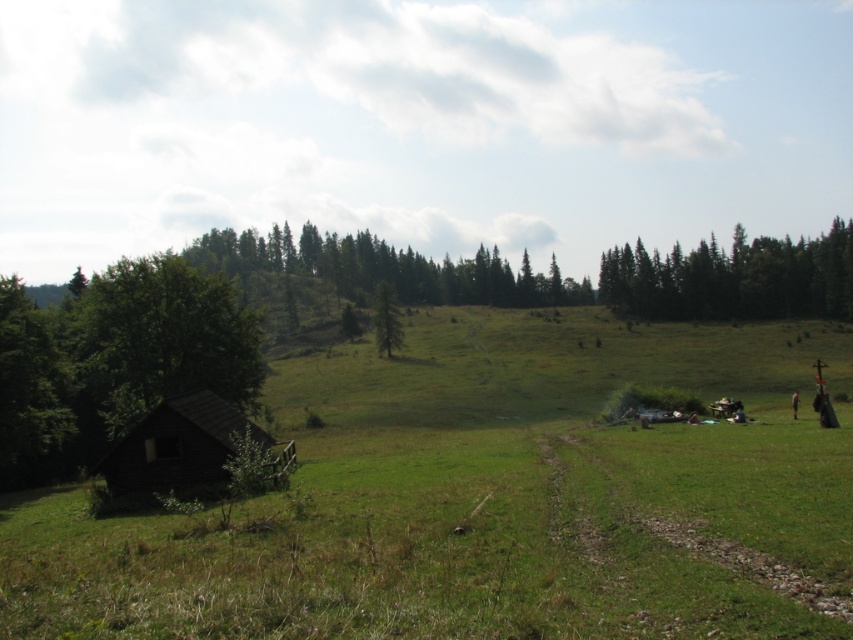
What is the position of the green leafy tree at left relative to the green coniferous trees at upper right?

The green leafy tree at left is positioned to the left of the green coniferous trees at upper right.